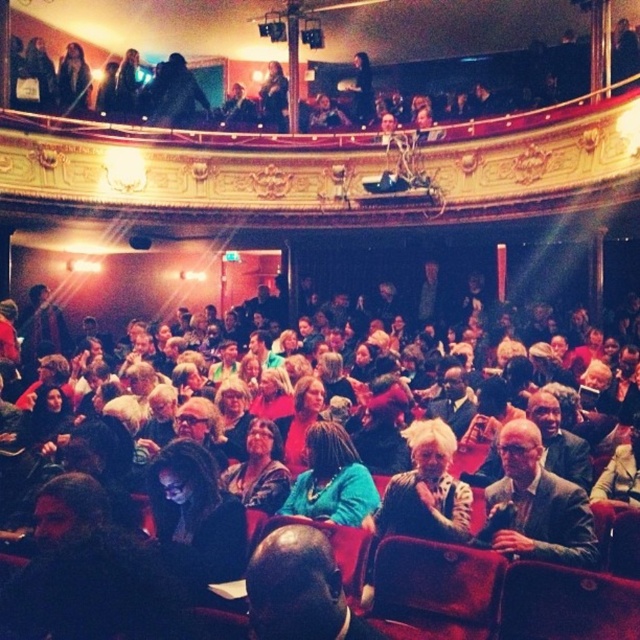
You are an event planner looking at the theater layout. You need to place a new decorative stand that must be positioned exactly at the point specified in the image. Which object is located at point (332, 480)?

The teal fabric dress at center is located at point (332, 480).

You are an usher in the theater and need to locate two attendees wearing a teal fabric dress at center and a dark brown leather jacket at center. From the perspective of someone sitting in the front row, which of these two items is closer to the stage?

The teal fabric dress at center is located below the dark brown leather jacket at center, so from the front row perspective, the teal fabric dress at center is closer to the stage since it is positioned lower in the seating arrangement.